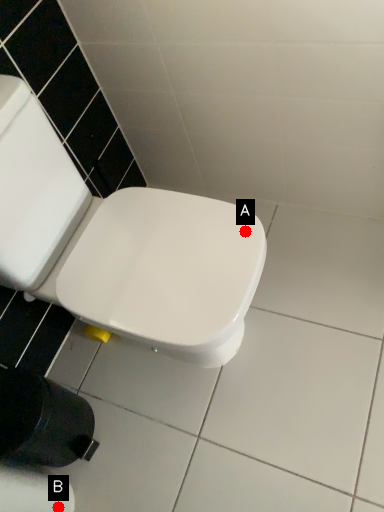
Question: Two points are circled on the image, labeled by A and B beside each circle. Among these points, which one is nearest to the camera?

Choices:
 (A) A is closer
 (B) B is closer

Answer: (A)